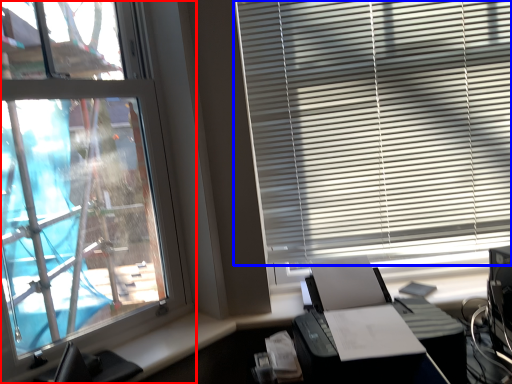
Question: Which object appears closest to the camera in this image, window (highlighted by a red box) or window blind (highlighted by a blue box)?

Choices:
 (A) window
 (B) window blind

Answer: (A)